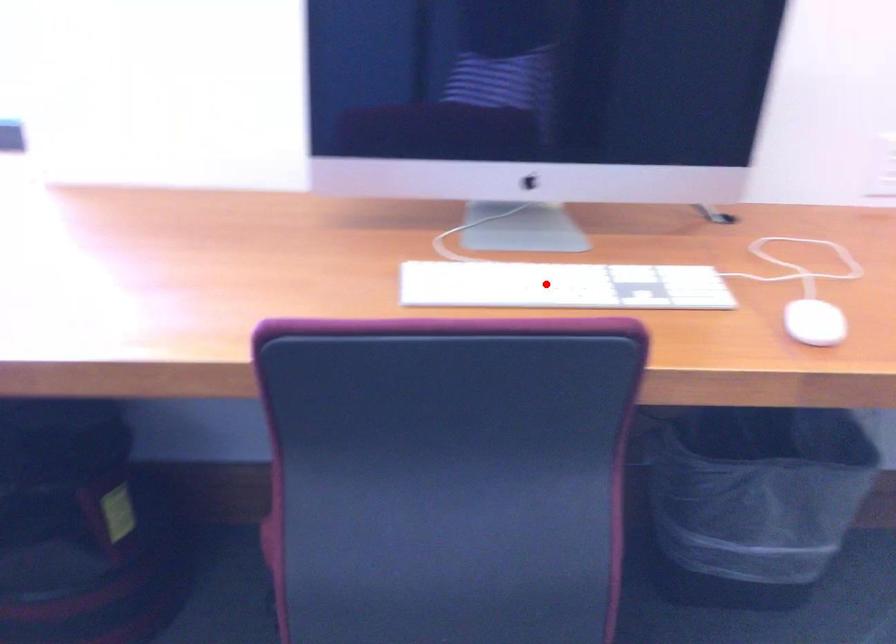
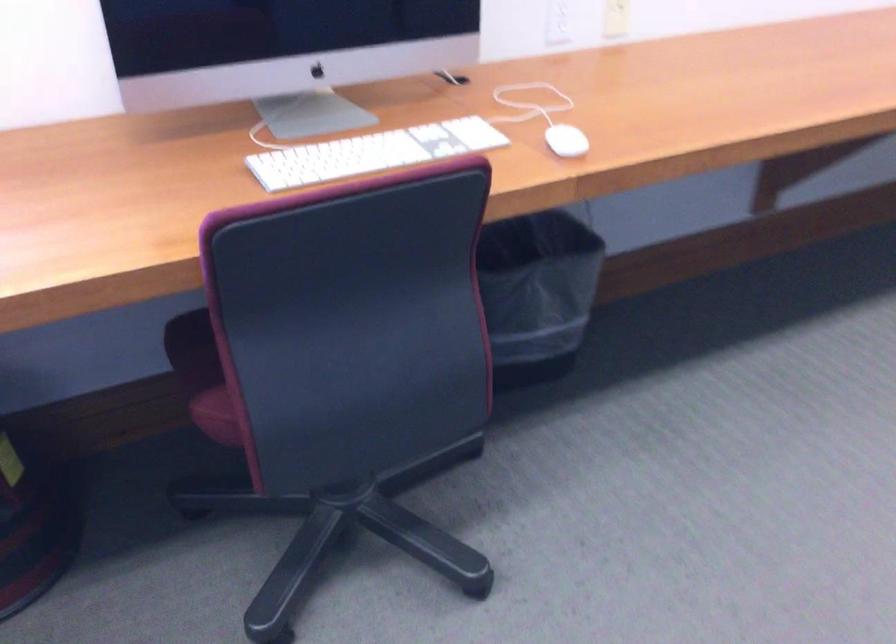
Question: I am providing you with two images of the same scene from different viewpoints. In image1, a red point is highlighted. Considering the same 3D point in image2, which of the following is correct?

Choices:
 (A) It is closer
 (B) It is farther

Answer: (B)